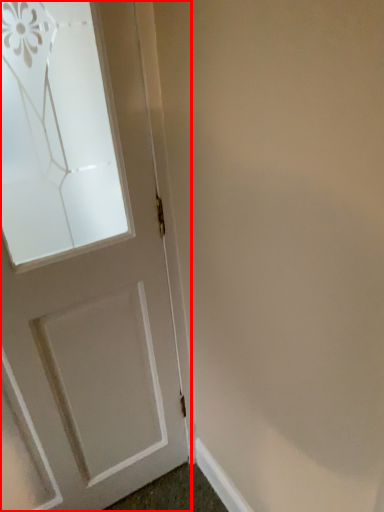
Question: From the image's perspective, where is door (annotated by the red box) located in relation to molding in the image?

Choices:
 (A) below
 (B) above

Answer: (B)